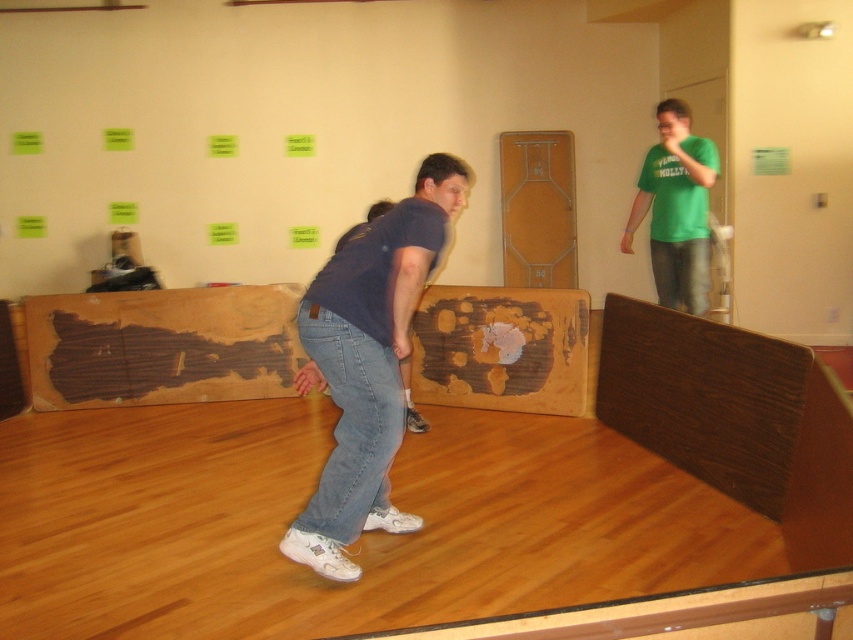
Between point (372, 378) and point (653, 262), which one is positioned behind?

Positioned behind is point (653, 262).

Is point (344, 433) more distant than point (699, 195)?

No.

In order to click on blue denim jeans at center in this screenshot , I will do `click(368, 364)`.

Is green matte shirt at upper right above wooden at center?

Actually, green matte shirt at upper right is below wooden at center.

Does point (688, 237) come behind point (561, 188)?

No, it is not.

Locate an element on the screen. The height and width of the screenshot is (640, 853). green matte shirt at upper right is located at coordinates (676, 209).

Can you confirm if blue denim jeans at center is taller than wooden at center?

Correct, blue denim jeans at center is much taller as wooden at center.

Is blue denim jeans at center below wooden at center?

Indeed, blue denim jeans at center is positioned under wooden at center.

You are a GUI agent. You are given a task and a screenshot of the screen. Output one action in this format:
    pyautogui.click(x=<x>, y=<y>)
    Task: Click on the blue denim jeans at center
    This screenshot has width=853, height=640.
    Given the screenshot: What is the action you would take?
    pos(368,364)